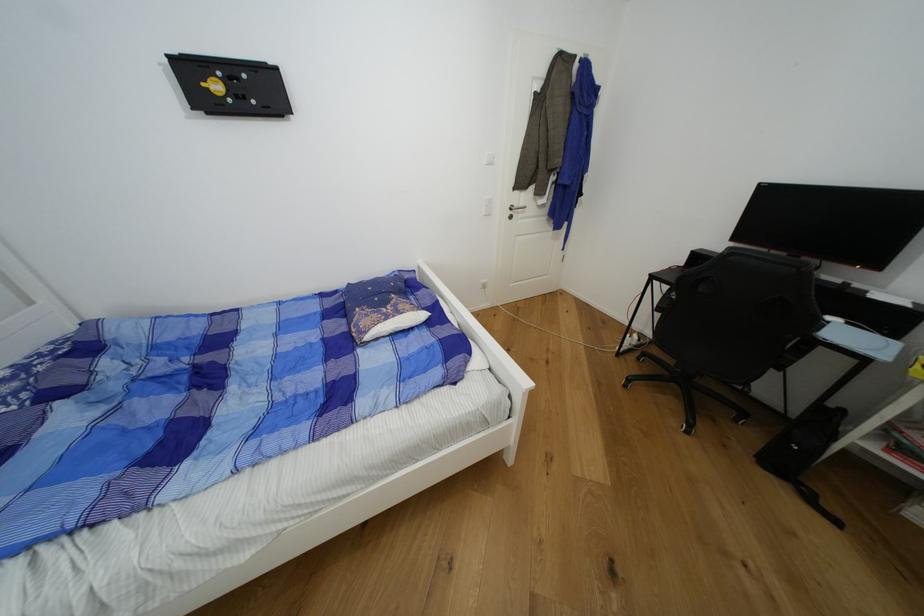
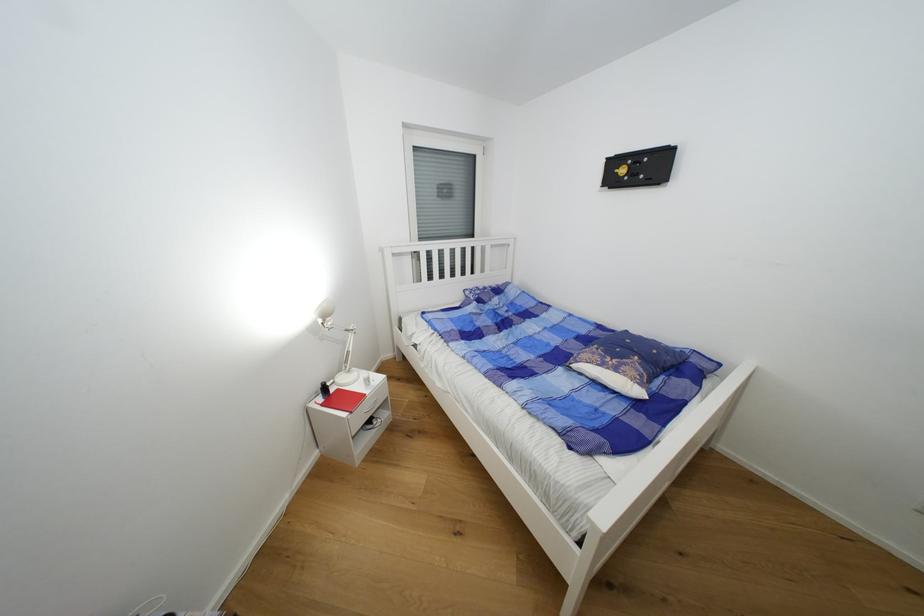
The point at (x=404, y=314) is marked in the first image. Where is the corresponding point in the second image?

(622, 371)